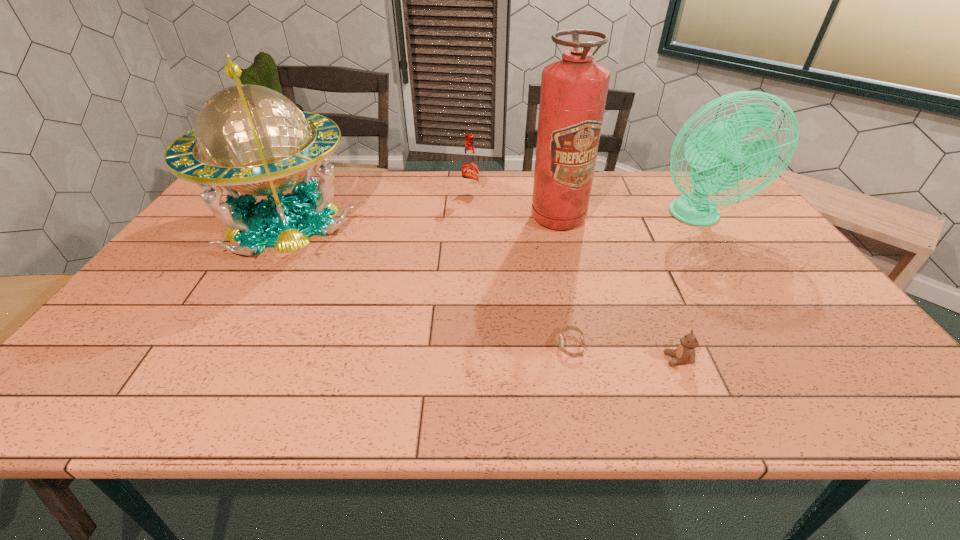
You are a GUI agent. You are given a task and a screenshot of the screen. Output one action in this format:
    pyautogui.click(x=<x>, y=<y>)
    Task: Click on the vacant area situated 0.290m in front of the rightmost object to blow air
    
    Given the screenshot: What is the action you would take?
    pyautogui.click(x=754, y=303)

Where is `vacant space located on the front of the fourth tallest object`? vacant space located on the front of the fourth tallest object is located at coordinates (468, 244).

Locate an element on the screen. vacant space located on the front-facing side of the second shortest object is located at coordinates (611, 360).

The height and width of the screenshot is (540, 960). Find the location of `free space located on the front-facing side of the second shortest object`. free space located on the front-facing side of the second shortest object is located at coordinates (562, 360).

Locate an element on the screen. This screenshot has width=960, height=540. vacant space positioned 0.250m on the front-facing side of the second shortest object is located at coordinates point(553,360).

Locate an element on the screen. vacant area located on the face of the watch is located at coordinates (475, 346).

Where is `vacant region located on the face of the watch`? This screenshot has height=540, width=960. vacant region located on the face of the watch is located at coordinates (445, 346).

The height and width of the screenshot is (540, 960). I want to click on free space located 0.210m on the face of the watch, so click(467, 346).

Image resolution: width=960 pixels, height=540 pixels. Identify the location of fire extinguisher that is at the far edge. (574, 89).

Find the location of a particular element. This screenshot has height=540, width=960. globe at the far edge is located at coordinates (251, 139).